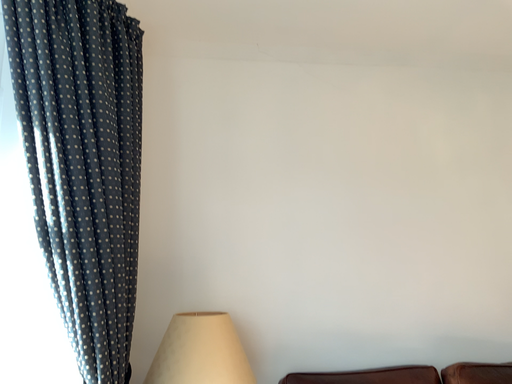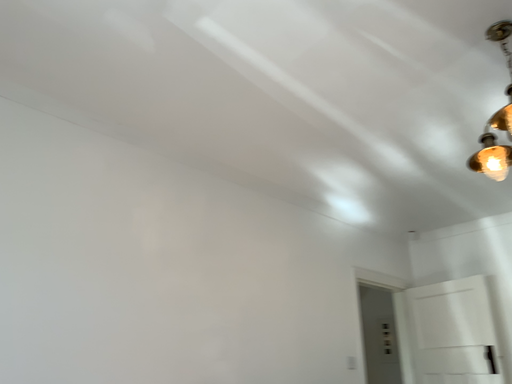
Question: Which way did the camera rotate in the video?

Choices:
 (A) rotated left
 (B) rotated right

Answer: (B)